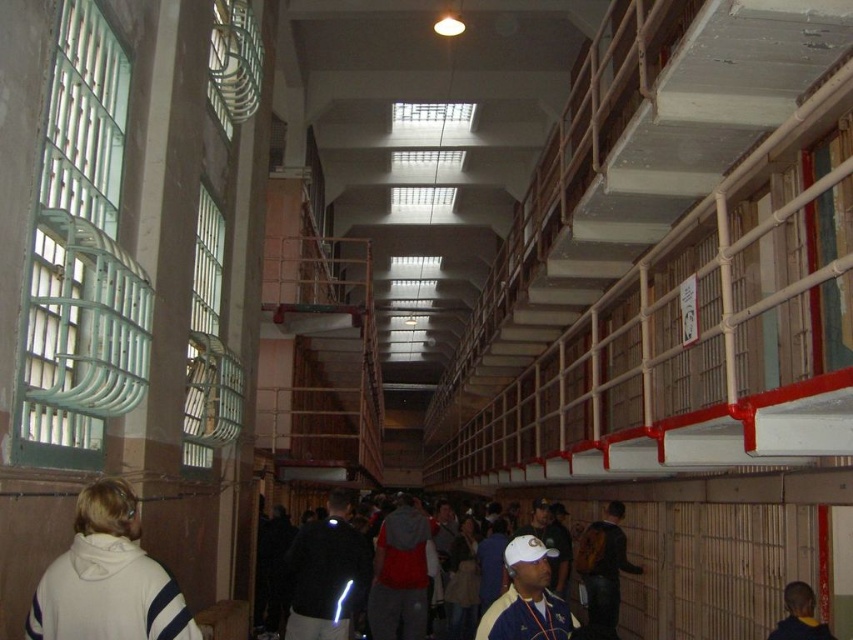
You are a guard in this prison cell block. You need to retrieve both the white fleece jacket at lower left and the dark blue hoodie at lower right. The maximum distance you can walk is 4 meters. Can you reach both items without exceeding your walking limit?

The white fleece jacket at lower left is 3.97 meters away from the dark blue hoodie at lower right. Since the distance between them is just under 4 meters, you can walk from one to the other and back within the 4 meter limit, so yes, you can retrieve both items without exceeding the walking limit.

You are a prison guard standing in the central corridor of the cell block. You see the white matte baseball cap at center and the dark gray fabric jacket at center. Which item is closer to you?

The white matte baseball cap at center is closer to you because it is further to the viewer than the dark gray fabric jacket at center.

You are a guard standing at the entrance of the prison cell block. You notice two points marked in the corridor. The first point is at coordinates point (x=332, y=534) and the second is at point (x=596, y=589). Which point is closer to your current position?

Point (x=332, y=534) is in front of point (x=596, y=589), so the first point is closer to your current position as a guard standing at the entrance.